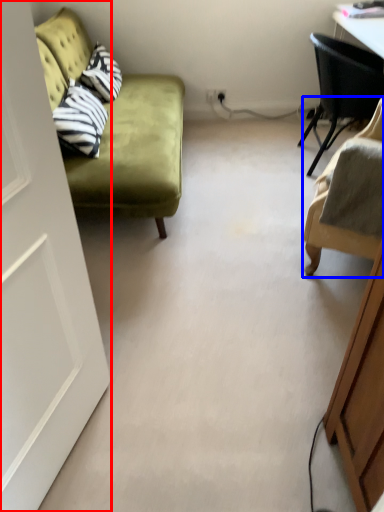
Question: Which object is closer to the camera taking this photo, door (highlighted by a red box) or chair (highlighted by a blue box)?

Choices:
 (A) door
 (B) chair

Answer: (A)